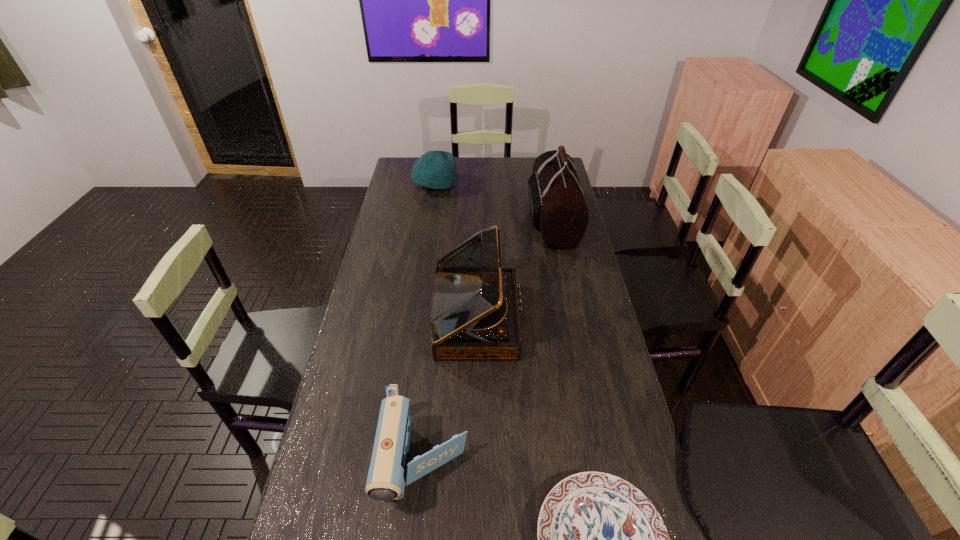
Locate an element on the screen. duffel bag is located at coordinates (559, 211).

Where is `the fourth shortest object`? the fourth shortest object is located at coordinates (474, 315).

Find the location of `the third nearest object`. the third nearest object is located at coordinates (474, 315).

At what (x,y) coordinates should I click in order to perform the action: click on beanie. Please return your answer as a coordinate pair (x, y). Image resolution: width=960 pixels, height=540 pixels. Looking at the image, I should click on (435, 169).

Locate an element on the screen. The height and width of the screenshot is (540, 960). camcorder is located at coordinates (389, 471).

Identify the location of free space located 0.290m on the front pocket of the duffel bag. (459, 219).

I want to click on vacant area situated on the front pocket of the duffel bag, so click(x=437, y=219).

You are a GUI agent. You are given a task and a screenshot of the screen. Output one action in this format:
    pyautogui.click(x=<x>, y=<y>)
    Task: Click on the blank area located 0.360m on the front pocket of the duffel bag
    The image size is (960, 540).
    Given the screenshot: What is the action you would take?
    pyautogui.click(x=442, y=219)

At what (x,y) coordinates should I click in order to perform the action: click on free location located 0.080m on the front-facing side of the third nearest object. Please return your answer as a coordinate pair (x, y). The height and width of the screenshot is (540, 960). Looking at the image, I should click on pyautogui.click(x=545, y=319).

This screenshot has width=960, height=540. Find the location of `blank space located 0.110m on the back of the beanie`. blank space located 0.110m on the back of the beanie is located at coordinates (438, 162).